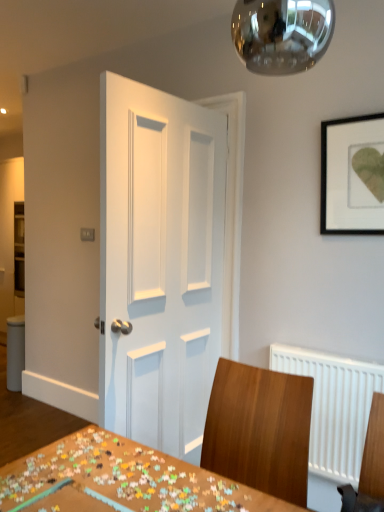
Question: Considering the relative sizes of wooden puzzle pieces at center and white painted wood door at center in the image provided, is wooden puzzle pieces at center shorter than white painted wood door at center?

Choices:
 (A) no
 (B) yes

Answer: (B)

Question: Can you confirm if wooden puzzle pieces at center is smaller than white painted wood door at center?

Choices:
 (A) no
 (B) yes

Answer: (B)

Question: From the image's perspective, is wooden puzzle pieces at center below white painted wood door at center?

Choices:
 (A) yes
 (B) no

Answer: (A)

Question: Is wooden puzzle pieces at center facing towards white painted wood door at center?

Choices:
 (A) no
 (B) yes

Answer: (A)

Question: Does wooden puzzle pieces at center have a larger size compared to white painted wood door at center?

Choices:
 (A) yes
 (B) no

Answer: (B)

Question: Could white painted wood door at center be considered to be inside wooden puzzle pieces at center?

Choices:
 (A) no
 (B) yes

Answer: (A)

Question: Can you confirm if black matte picture frame at upper right is taller than wooden puzzle pieces at center?

Choices:
 (A) yes
 (B) no

Answer: (A)

Question: Is there a large distance between black matte picture frame at upper right and wooden puzzle pieces at center?

Choices:
 (A) no
 (B) yes

Answer: (B)

Question: Considering the relative positions of black matte picture frame at upper right and wooden puzzle pieces at center in the image provided, is black matte picture frame at upper right behind wooden puzzle pieces at center?

Choices:
 (A) yes
 (B) no

Answer: (A)

Question: From the image's perspective, is black matte picture frame at upper right located beneath wooden puzzle pieces at center?

Choices:
 (A) yes
 (B) no

Answer: (B)

Question: Is black matte picture frame at upper right directly adjacent to wooden puzzle pieces at center?

Choices:
 (A) yes
 (B) no

Answer: (B)

Question: Is black matte picture frame at upper right to the left of wooden puzzle pieces at center from the viewer's perspective?

Choices:
 (A) yes
 (B) no

Answer: (B)

Question: Does wooden chair at center have a larger size compared to white painted wood door at center?

Choices:
 (A) no
 (B) yes

Answer: (A)